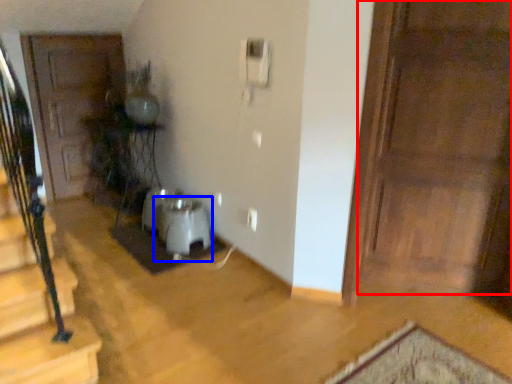
Question: Which of the following is the farthest to the observer, door (highlighted by a red box) or water heater (highlighted by a blue box)?

Choices:
 (A) door
 (B) water heater

Answer: (B)